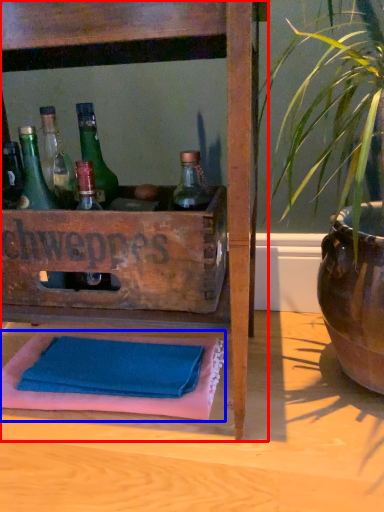
Question: Which of the following is the farthest to the observer, furniture (highlighted by a red box) or bath towel (highlighted by a blue box)?

Choices:
 (A) furniture
 (B) bath towel

Answer: (B)